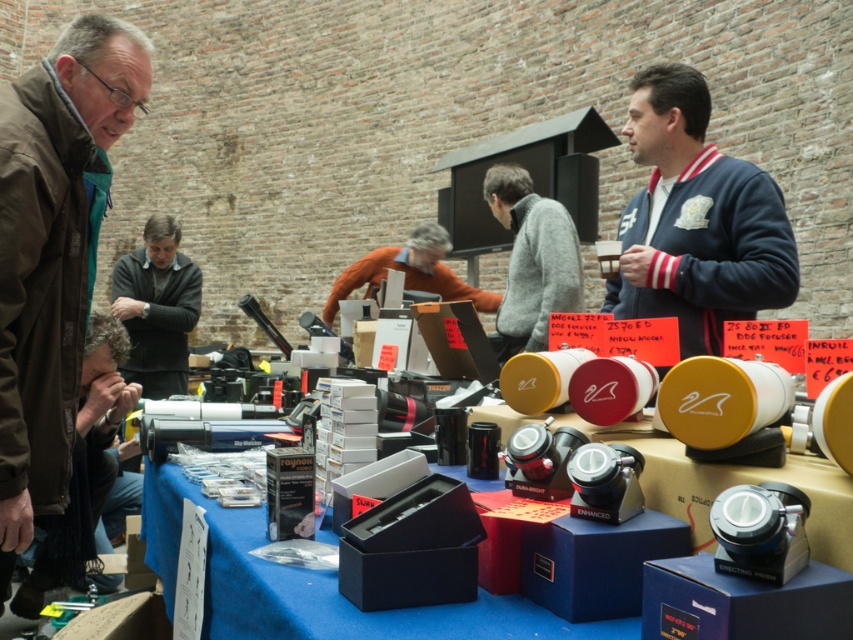
You are a customer at the market and want to find the blue cardboard boxes at center. According to the coordinates provided, where exactly are they located in the image?

The blue cardboard boxes at center are located at coordinates point (312, 586) in the image.

Please describe the object located at the coordinates point (x=532, y=259) in the image.

The object at point (x=532, y=259) is the gray sweater at center.